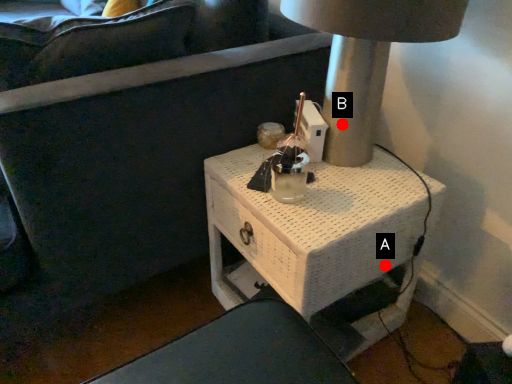
Question: Two points are circled on the image, labeled by A and B beside each circle. Which point appears farthest from the camera in this image?

Choices:
 (A) A is further
 (B) B is further

Answer: (A)